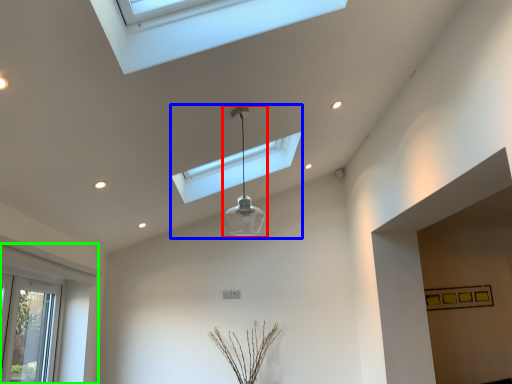
Question: Based on their relative distances, which object is farther from lamp (highlighted by a red box)? Choose from lamp (highlighted by a blue box) and window (highlighted by a green box).

Choices:
 (A) lamp
 (B) window

Answer: (B)